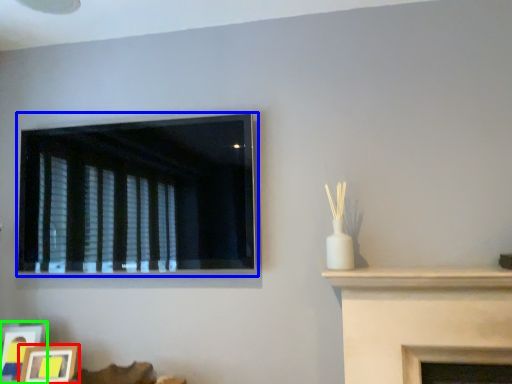
Question: Which object is the closest to the picture frame (highlighted by a red box)? Choose among these: window (highlighted by a blue box) or picture frame (highlighted by a green box).

Choices:
 (A) window
 (B) picture frame

Answer: (B)